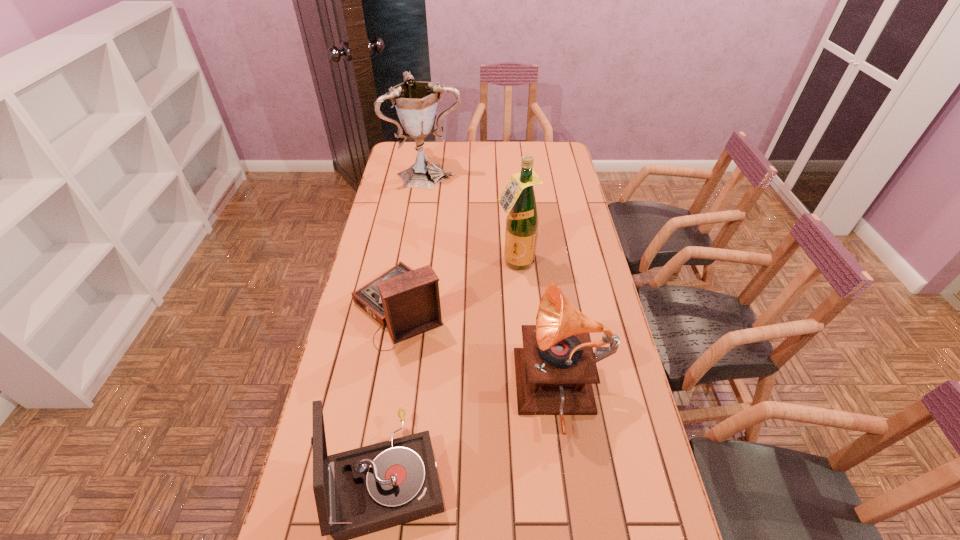
This screenshot has height=540, width=960. Find the location of `vacant space situated 0.200m on the front of the shortest object`. vacant space situated 0.200m on the front of the shortest object is located at coordinates [x=380, y=413].

The height and width of the screenshot is (540, 960). Find the location of `object that is positioned at the far edge`. object that is positioned at the far edge is located at coordinates (416, 102).

Image resolution: width=960 pixels, height=540 pixels. Find the location of `trophy cup that is at the left edge`. trophy cup that is at the left edge is located at coordinates (416, 102).

Where is `phonograph record that is at the left edge`? phonograph record that is at the left edge is located at coordinates (407, 301).

You are a GUI agent. You are given a task and a screenshot of the screen. Output one action in this format:
    pyautogui.click(x=<x>, y=<y>)
    Task: Click on the object located in the right edge section of the desktop
    The width and height of the screenshot is (960, 540).
    Given the screenshot: What is the action you would take?
    pyautogui.click(x=555, y=369)

The height and width of the screenshot is (540, 960). I want to click on object that is positioned at the far left corner, so click(416, 102).

This screenshot has height=540, width=960. In the image, there is a desktop. What are the coordinates of `free space at the far edge` in the screenshot? It's located at (457, 159).

Find the location of a particular element. The height and width of the screenshot is (540, 960). free space at the left edge is located at coordinates (394, 199).

In the image, there is a desktop. Where is `vacant space at the right edge`? The width and height of the screenshot is (960, 540). vacant space at the right edge is located at coordinates (606, 324).

This screenshot has width=960, height=540. I want to click on free region at the far left corner, so click(x=404, y=165).